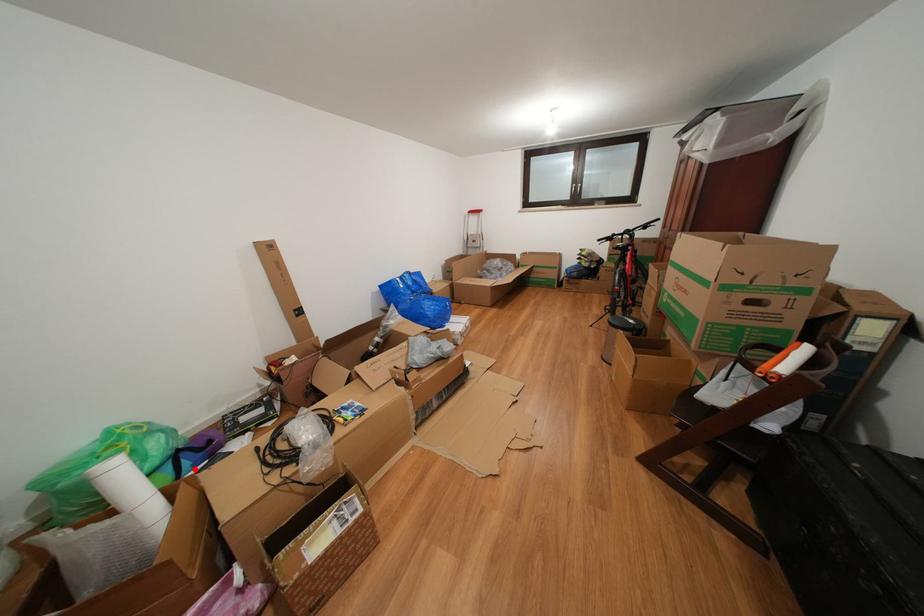
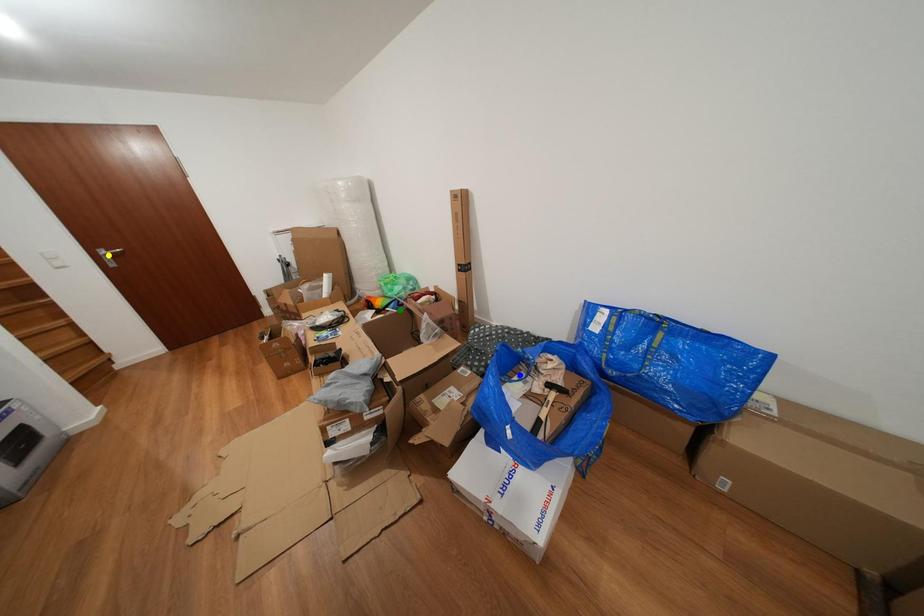
Question: I am providing you with two images of the same scene from different viewpoints. A red point is marked on the first image. You are given multiple points on the second image. Which spot in image 2 lines up with the point in image 1?

Choices:
 (A) yellow point
 (B) blue point
 (C) green point

Answer: (C)